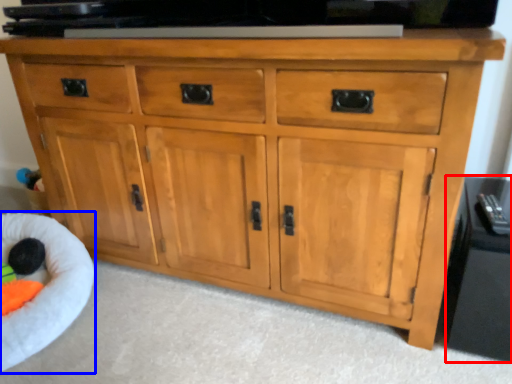
Question: Among these objects, which one is nearest to the camera, side cabinet (highlighted by a red box) or infant bed (highlighted by a blue box)?

Choices:
 (A) side cabinet
 (B) infant bed

Answer: (A)